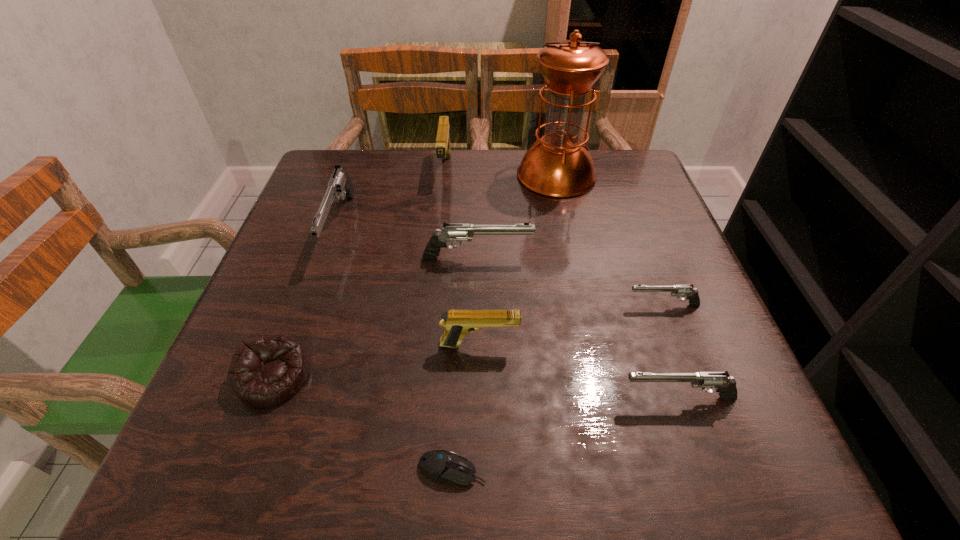
Find the location of a particular element. This screenshot has width=960, height=540. the tallest object is located at coordinates (559, 165).

The height and width of the screenshot is (540, 960). Identify the location of the bigger tan pistol. (443, 147).

Where is `the farther tan pistol`? the farther tan pistol is located at coordinates (443, 147).

This screenshot has width=960, height=540. Identify the location of the leftmost pistol. (340, 185).

This screenshot has width=960, height=540. In order to click on the biggest silver pistol in this screenshot , I will do `click(340, 185)`.

Locate an element on the screen. the third silver pistol from right to left is located at coordinates (451, 232).

Identify the location of the right tan pistol. (457, 323).

What are the coordinates of `the smaller tan pistol` in the screenshot? It's located at coord(457,323).

Where is `the second smallest silver pistol`? The width and height of the screenshot is (960, 540). the second smallest silver pistol is located at coordinates (726, 386).

Find the location of a particular element. the nearest pistol is located at coordinates (726, 386).